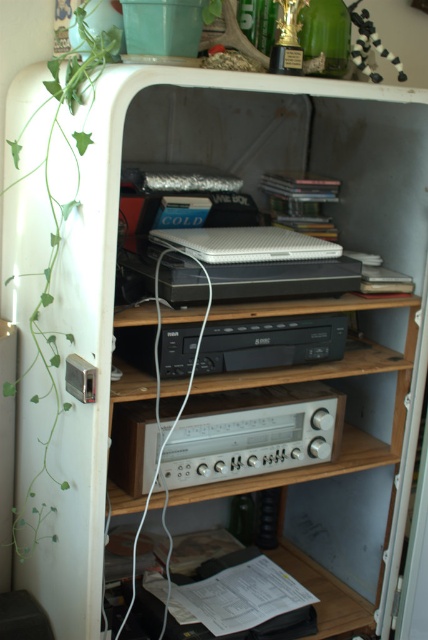
You are standing in front of the repurposed refrigerator storage unit. There is a point marked at coordinate (299, 419). Can you reach this point with your hand if you are 5.5 feet tall?

The point at coordinate (299, 419) is 4.27 feet from the camera. Since you are 5.5 feet tall, you can reach up to about 5.5 feet. The distance to the point is 4.27 feet, which is within your reach. Therefore, you can reach the point with your hand.

You are trying to decide if the silver metallic stereo at center will fit under a shelf that can only accommodate items shorter than the green leafy plant at left. Based on the image, can the stereo fit?

The silver metallic stereo at center is not as tall as the green leafy plant at left, so it will fit under the shelf since it is shorter than the required height.